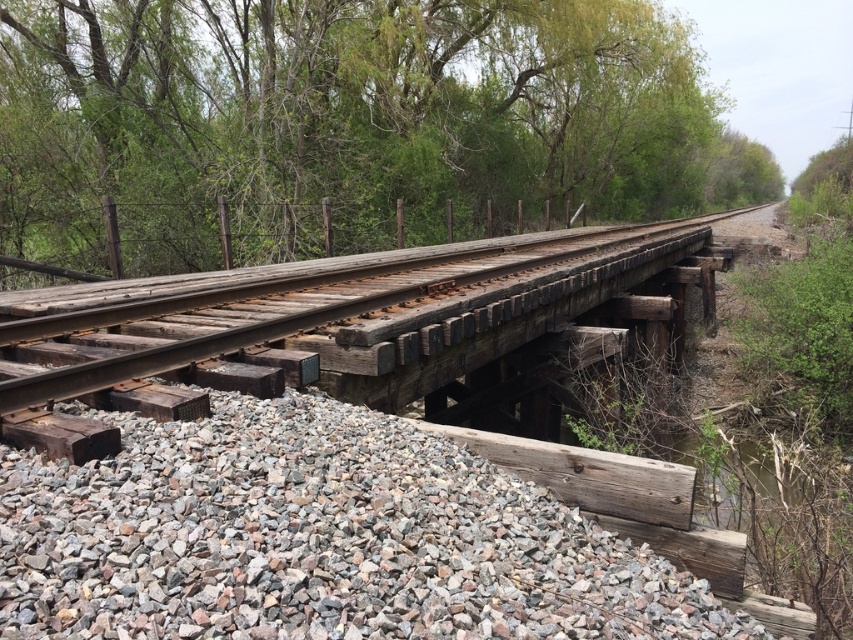
Between green leafy tree at center and rusty metal rail at center, which one appears on the left side from the viewer's perspective?

Positioned to the left is rusty metal rail at center.

Is green leafy tree at center thinner than rusty metal rail at center?

Incorrect, green leafy tree at center's width is not less than rusty metal rail at center's.

Between point (509, 77) and point (223, 285), which one is positioned behind?

Positioned behind is point (509, 77).

The height and width of the screenshot is (640, 853). I want to click on green leafy tree at center, so click(x=346, y=122).

Who is positioned more to the right, gray gravel at lower left or rusty metal rail at center?

rusty metal rail at center is more to the right.

Which of these two, gray gravel at lower left or rusty metal rail at center, stands shorter?

With less height is gray gravel at lower left.

This screenshot has height=640, width=853. I want to click on gray gravel at lower left, so click(x=318, y=540).

You are a GUI agent. You are given a task and a screenshot of the screen. Output one action in this format:
    pyautogui.click(x=<x>, y=<y>)
    Task: Click on the gray gravel at lower left
    
    Given the screenshot: What is the action you would take?
    pyautogui.click(x=318, y=540)

In the scene shown: Does green leafy tree at center have a lesser height compared to gray gravel at lower left?

No.

Looking at this image, between green leafy tree at center and gray gravel at lower left, which one has more height?

green leafy tree at center is taller.

Is point (587, 180) farther from viewer compared to point (343, 625)?

Yes, point (587, 180) is behind point (343, 625).

Identify the location of green leafy tree at center. The width and height of the screenshot is (853, 640). (346, 122).